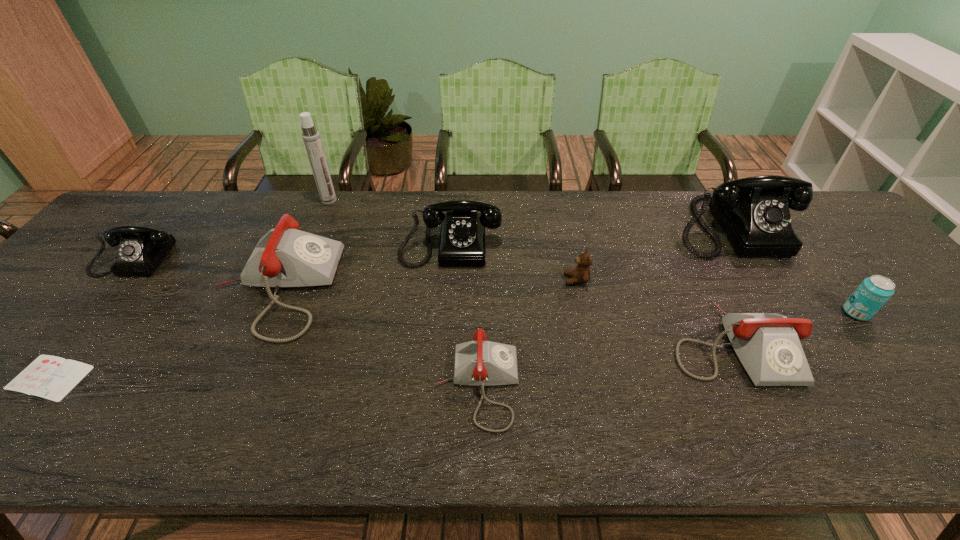
At what (x,y) coordinates should I click in order to perform the action: click on free space at the far edge of the desktop. Please return your answer as a coordinate pair (x, y). The height and width of the screenshot is (540, 960). Looking at the image, I should click on (516, 199).

Where is `free space at the near edge`? free space at the near edge is located at coordinates (749, 424).

Find the location of `vacant space at the left edge of the desktop`. vacant space at the left edge of the desktop is located at coordinates (67, 318).

The width and height of the screenshot is (960, 540). In the image, there is a desktop. What are the coordinates of `free region at the right edge` in the screenshot? It's located at (885, 269).

Locate an element on the screen. blank region between the aerosol can and the leftmost black telephone is located at coordinates (235, 228).

The image size is (960, 540). I want to click on vacant region between the rightmost black telephone and the beer can, so click(793, 269).

Where is `free point between the leftmost telephone and the aerosol can`? free point between the leftmost telephone and the aerosol can is located at coordinates (235, 228).

The image size is (960, 540). Identify the location of vacant region between the teddy bear and the second tallest telephone. (514, 260).

At what (x,y) coordinates should I click in order to perform the action: click on vacant space that's between the ninth shortest object and the fifth telephone from right to left. Please return your answer as a coordinate pair (x, y). Image resolution: width=960 pixels, height=540 pixels. Looking at the image, I should click on (503, 257).

Locate an element on the screen. This screenshot has width=960, height=540. vacant area that lies between the biggest red telephone and the beer can is located at coordinates (565, 300).